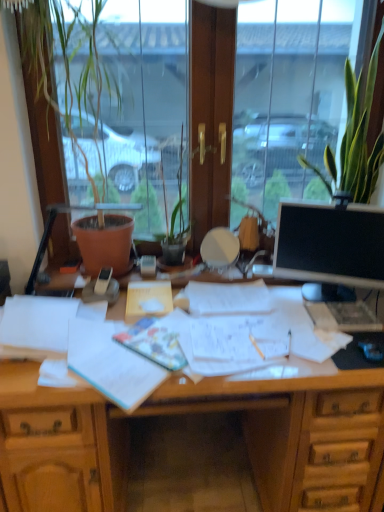
Locate an element on the screen. The image size is (384, 512). empty space that is ontop of wooden desk at center (from a real-world perspective) is located at coordinates (241, 327).